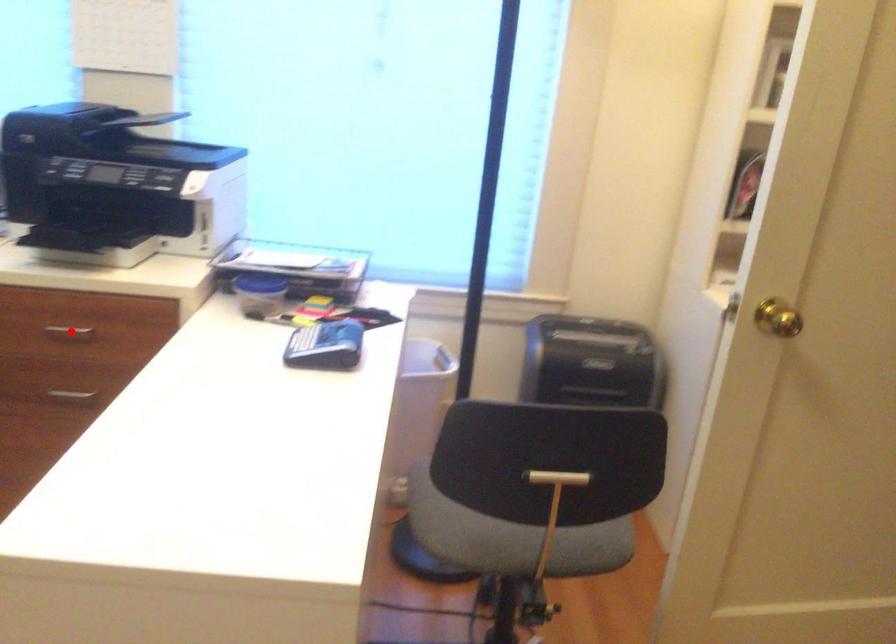
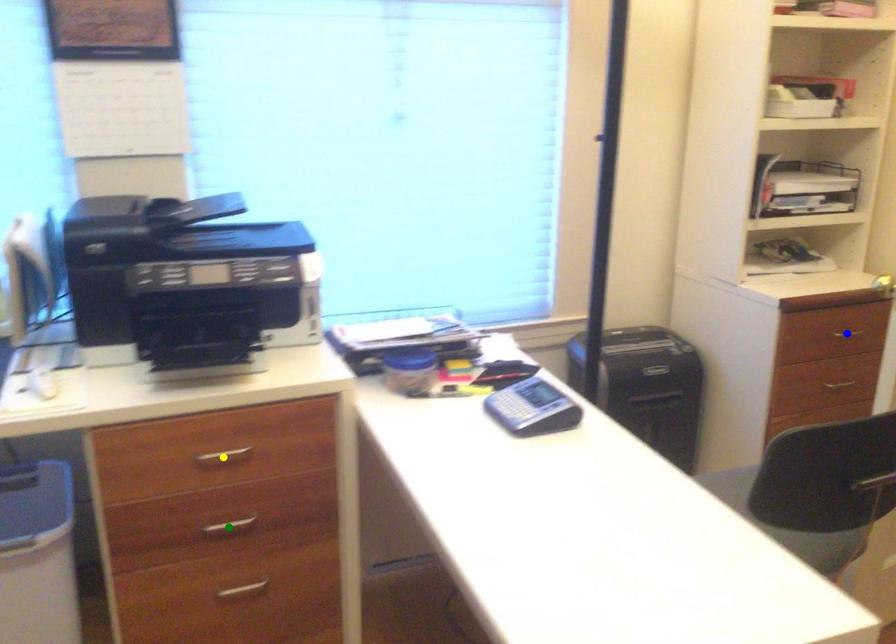
Question: I am providing you with two images of the same scene from different viewpoints. A red point is marked on the first image. You are given multiple points on the second image. Which mark in image 2 goes with the point in image 1?

Choices:
 (A) blue point
 (B) green point
 (C) yellow point

Answer: (C)